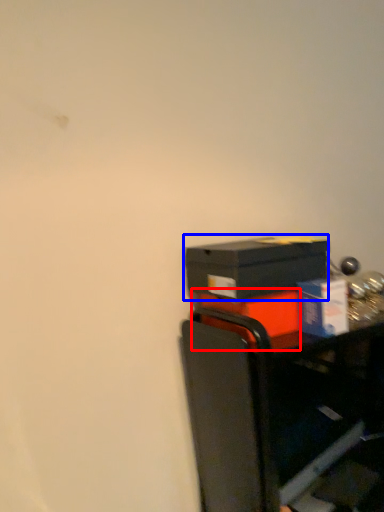
Question: Among these objects, which one is farthest to the camera, box (highlighted by a red box) or box (highlighted by a blue box)?

Choices:
 (A) box
 (B) box

Answer: (A)